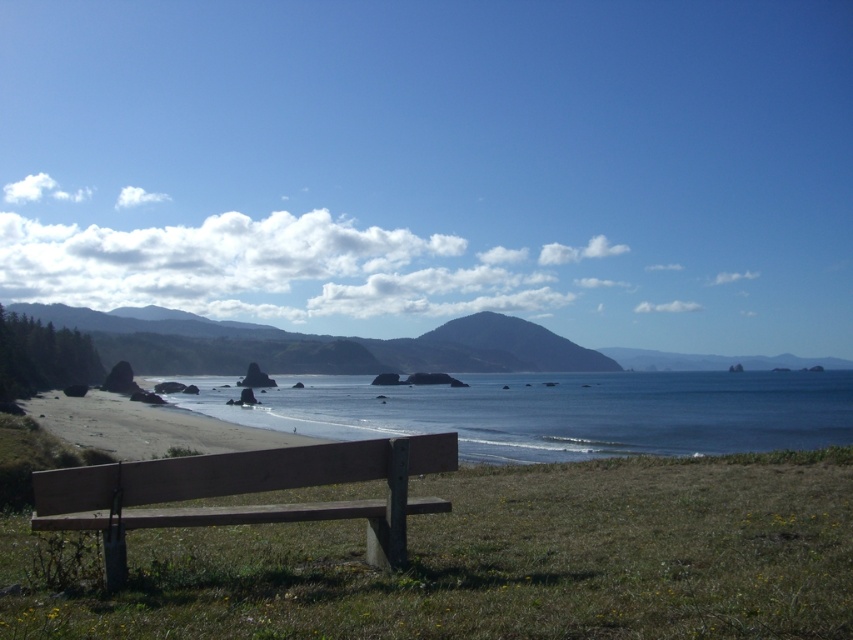
You are a hiker who wants to sit down and rest. You see the green grass at lower center and the wooden bench at lower left. Which one is taller?

The green grass at lower center is taller than the wooden bench at lower left.

Looking at this image, you are a photographer planning to capture a sunset at the coastal landscape. You want to ensure the wooden bench at lower left is visible in the foreground while still showing the blue water at center. Given their relative heights, will the bench be visible above the water when the sun is low on the horizon?

The blue water at center is much taller than the wooden bench at lower left. Since the bench is lower, it may be partially obscured by the water when the sun is low, making it harder to see clearly in the foreground.

You are a person with a 1.5 meter long surfboard. You want to place your surfboard horizontally between the green grass at lower center and the wooden bench at lower left. Will the surfboard fit without overlapping either object?

The distance between the green grass at lower center and the wooden bench at lower left is 2.92 meters. Since the surfboard is 1.5 meters long, it will fit between them without overlapping either object.